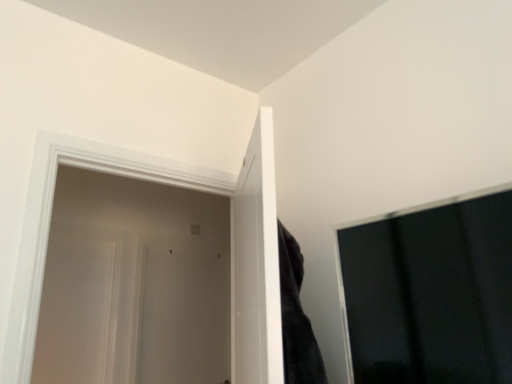
Question: From a real-world perspective, is white glossy door at left, which appears as the second door when viewed from the back, below white glossy door at left, which is the third door in back-to-front order?

Choices:
 (A) yes
 (B) no

Answer: (A)

Question: Is the depth of white glossy door at left, which appears as the second door when viewed from the back, less than that of white glossy door at left, the first door in the right-to-left sequence?

Choices:
 (A) yes
 (B) no

Answer: (B)

Question: Is white glossy door at left, which appears as the 1th door when viewed from the left, far away from white glossy door at left, which is the third door in back-to-front order?

Choices:
 (A) yes
 (B) no

Answer: (A)

Question: Does white glossy door at left, the second door viewed from the front, contain white glossy door at left, the first door in the right-to-left sequence?

Choices:
 (A) no
 (B) yes

Answer: (A)

Question: Is white glossy door at left, which is the third door from right to left, to the left of white glossy door at left, the first door in the right-to-left sequence, from the viewer's perspective?

Choices:
 (A) no
 (B) yes

Answer: (B)

Question: Looking at their shapes, would you say white glossy door at left, the first door positioned from the front, is wider or thinner than white matte door at center, arranged as the 3th door when viewed from the front?

Choices:
 (A) thin
 (B) wide

Answer: (B)

Question: From a real-world perspective, is white glossy door at left, placed as the 3th door when sorted from left to right, above or below white matte door at center, which is counted as the 1th door, starting from the back?

Choices:
 (A) below
 (B) above

Answer: (B)

Question: Looking at the image, does white glossy door at left, which is the third door in back-to-front order, seem bigger or smaller compared to white matte door at center, positioned as the 2th door in left-to-right order?

Choices:
 (A) small
 (B) big

Answer: (B)

Question: Relative to white matte door at center, positioned as the 2th door in left-to-right order, is white glossy door at left, the first door in the right-to-left sequence, in front or behind?

Choices:
 (A) front
 (B) behind

Answer: (A)

Question: In terms of width, does white matte door at center, which is counted as the 1th door, starting from the back, look wider or thinner when compared to white glossy door at left, which appears as the 1th door when viewed from the left?

Choices:
 (A) wide
 (B) thin

Answer: (A)

Question: Is point (162, 304) closer or farther from the camera than point (109, 289)?

Choices:
 (A) farther
 (B) closer

Answer: (A)

Question: Do you think white matte door at center, arranged as the 3th door when viewed from the front, is within white glossy door at left, which appears as the 1th door when viewed from the left, or outside of it?

Choices:
 (A) outside
 (B) inside

Answer: (A)

Question: From a real-world perspective, is white matte door at center, positioned as the 2th door in left-to-right order, physically located above or below white glossy door at left, which is the third door from right to left?

Choices:
 (A) above
 (B) below

Answer: (B)

Question: Is white glossy door at left, which appears as the second door when viewed from the back, in front of or behind white glossy door at left, the first door positioned from the front, in the image?

Choices:
 (A) front
 (B) behind

Answer: (B)

Question: From the image's perspective, is white glossy door at left, which is the third door from right to left, positioned above or below white glossy door at left, placed as the 3th door when sorted from left to right?

Choices:
 (A) above
 (B) below

Answer: (B)